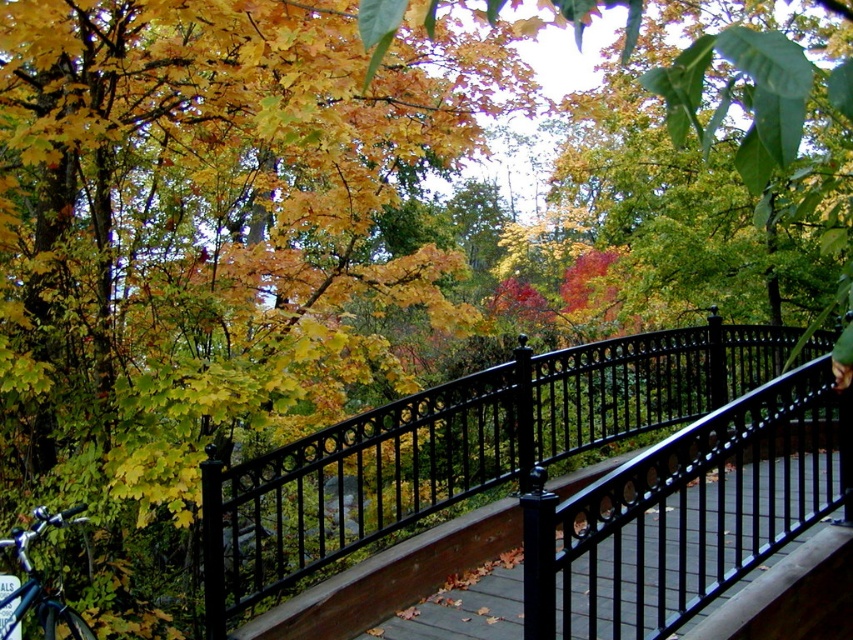
You are a painter standing on the wooden bridge and want to paint both the black wrought iron fence at center and the shiny blue bicycle at lower left. Which object will require you to look upward more to paint?

The black wrought iron fence at center is much taller than the shiny blue bicycle at lower left, so you will need to look upward more to paint the black wrought iron fence at center.